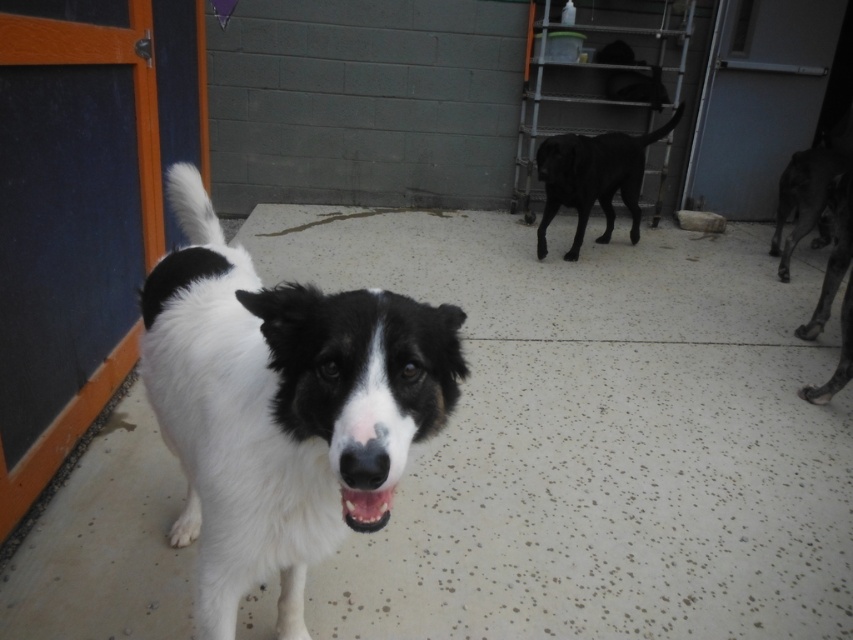
Looking at this image, does black smooth dog at right have a larger size compared to white glossy teeth at center?

Yes, black smooth dog at right is bigger than white glossy teeth at center.

Is black smooth dog at right below white glossy teeth at center?

Actually, black smooth dog at right is above white glossy teeth at center.

Locate an element on the screen. black smooth dog at right is located at coordinates (813, 221).

At what (x,y) coordinates should I click in order to perform the action: click on black smooth dog at right. Please return your answer as a coordinate pair (x, y). The height and width of the screenshot is (640, 853). Looking at the image, I should click on (813, 221).

Measure the distance between white fur dog at center and black smooth dog at center.

3.33 meters

Is white fur dog at center wider than black smooth dog at center?

No.

Does point (352, 381) come farther from viewer compared to point (541, 250)?

No, it is in front of (541, 250).

Where is `white fur dog at center`? white fur dog at center is located at coordinates (279, 404).

Can you confirm if black smooth dog at center is thinner than black smooth dog at right?

Yes, black smooth dog at center is thinner than black smooth dog at right.

Which is more to the left, black smooth dog at center or black smooth dog at right?

From the viewer's perspective, black smooth dog at center appears more on the left side.

Is point (635, 200) closer to camera compared to point (824, 164)?

No, it is behind (824, 164).

You are a GUI agent. You are given a task and a screenshot of the screen. Output one action in this format:
    pyautogui.click(x=<x>, y=<y>)
    Task: Click on the black smooth dog at center
    
    Given the screenshot: What is the action you would take?
    pyautogui.click(x=593, y=179)